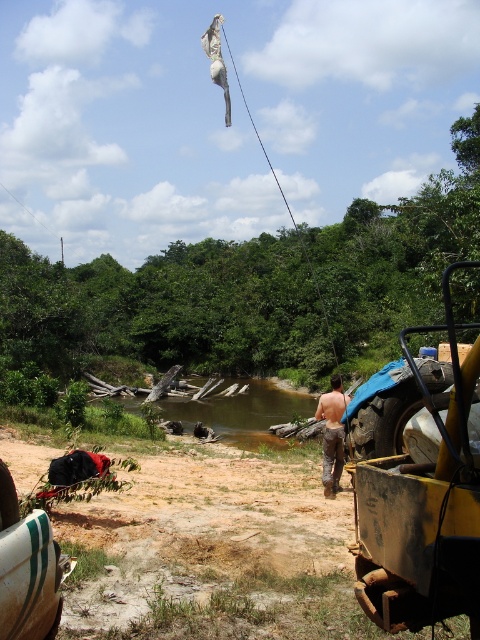
Is point (372, 467) positioned in front of point (334, 401)?

Yes, point (372, 467) is in front of point (334, 401).

Is yellow metallic tractor at right wider than brown/canvas pants at center?

Yes.

Which is behind, point (375, 566) or point (337, 440)?

Positioned behind is point (337, 440).

Identify the location of yellow metallic tractor at right. Image resolution: width=480 pixels, height=640 pixels. (422, 508).